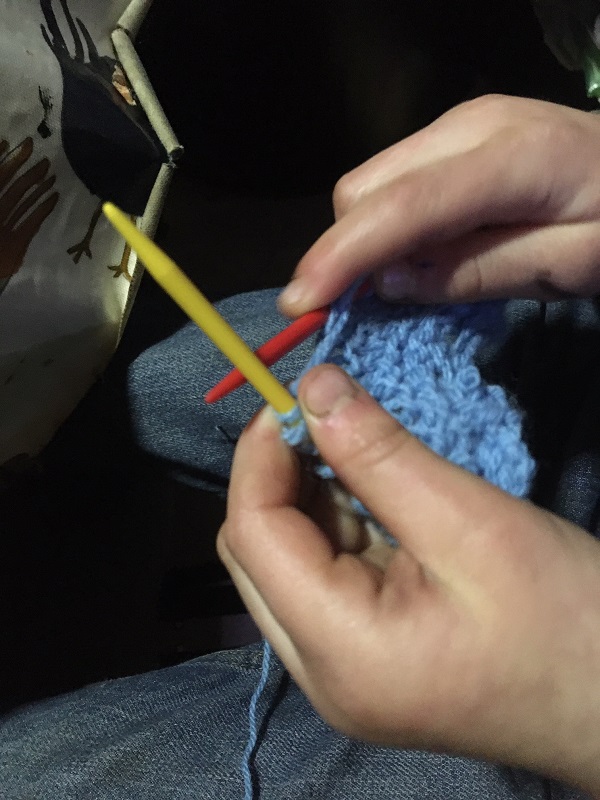
The width and height of the screenshot is (600, 800). Identify the location of patterned fabric. (60, 237).